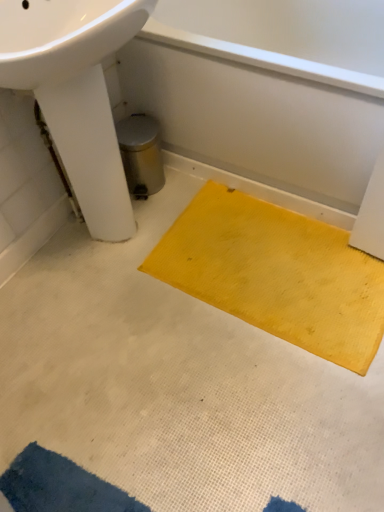
Question: From a real-world perspective, relative to yellow rubber mat at center, the second doormat from the left, is white glossy sink at upper left vertically above or below?

Choices:
 (A) above
 (B) below

Answer: (A)

Question: From the image's perspective, is white glossy sink at upper left positioned above or below yellow rubber mat at center, which ranks as the second doormat in front-to-back order?

Choices:
 (A) above
 (B) below

Answer: (A)

Question: Considering the real-world distances, which object is closest to the white glossy sink at upper left?

Choices:
 (A) blue textured mat at lower left, the 2th doormat viewed from the top
 (B) yellow rubber mat at center, arranged as the 1th doormat when viewed from the right
 (C) yellow rubber mat at lower right

Answer: (C)

Question: Which object is the farthest from the white glossy sink at upper left?

Choices:
 (A) yellow rubber mat at lower right
 (B) blue textured mat at lower left, the 2th doormat viewed from the top
 (C) yellow rubber mat at center, arranged as the 1th doormat when viewed from the right

Answer: (B)